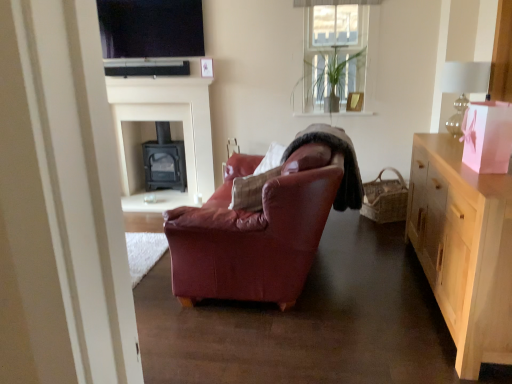
Question: Would you say woven brown picnic basket at right is inside or outside light wood cabinet at right?

Choices:
 (A) inside
 (B) outside

Answer: (B)

Question: From the image's perspective, relative to light wood cabinet at right, is woven brown picnic basket at right above or below?

Choices:
 (A) below
 (B) above

Answer: (B)

Question: Which of these objects is positioned closest to the matte black tv at upper center?

Choices:
 (A) woven brown picnic basket at right
 (B) black matte soundbar at upper center
 (C) green glossy plant at upper center
 (D) matte black tv at upper center
 (E) clear glass lampshade at upper right

Answer: (B)

Question: Which of these objects is positioned farthest from the black matte soundbar at upper center?

Choices:
 (A) matte black tv at upper center
 (B) black matte fireplace at center, the 1th fireplace positioned from the back
 (C) light wood cabinet at right
 (D) clear glass lampshade at upper right
 (E) green glossy plant at upper center

Answer: (C)